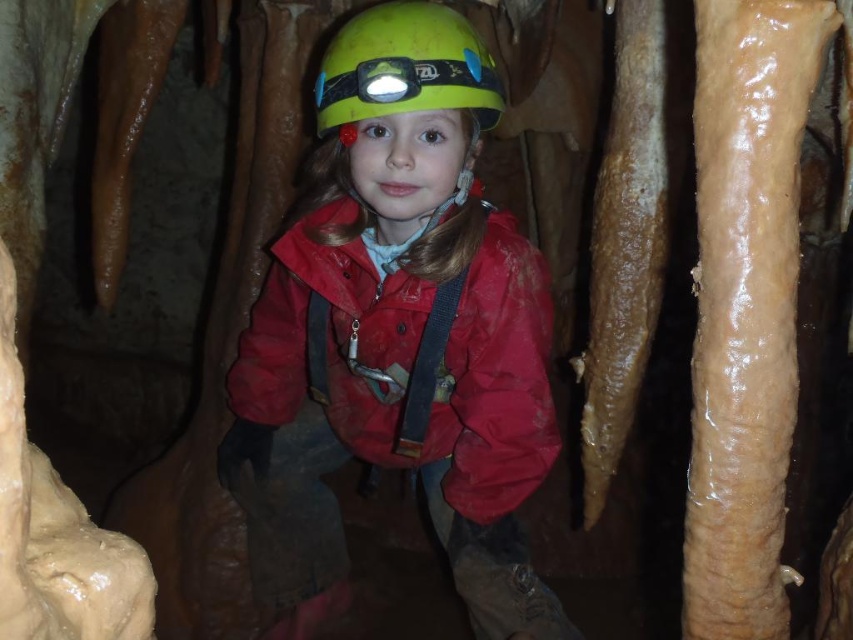
Describe the element at coordinates (396, 371) in the screenshot. I see `matte red jacket at center` at that location.

Is matte red jacket at center to the left of green matte helmet at center from the viewer's perspective?

No, matte red jacket at center is not to the left of green matte helmet at center.

The image size is (853, 640). I want to click on matte red jacket at center, so click(396, 371).

Does point (316, 108) come closer to viewer compared to point (465, 65)?

No.

Is yellow matte helmet at center taller than green matte helmet at center?

Indeed, yellow matte helmet at center has a greater height compared to green matte helmet at center.

Does point (422, 20) come behind point (337, 88)?

That is False.

Identify the location of yellow matte helmet at center. The width and height of the screenshot is (853, 640). (405, 67).

Is point (436, 36) farther from camera compared to point (392, 96)?

Yes, point (436, 36) is farther from viewer.

Is matte red jacket at center shorter than yellow matte helmet at center?

No.

Is point (554, 440) positioned behind point (405, 102)?

Yes.

Image resolution: width=853 pixels, height=640 pixels. What are the coordinates of `matte red jacket at center` in the screenshot? It's located at (396, 371).